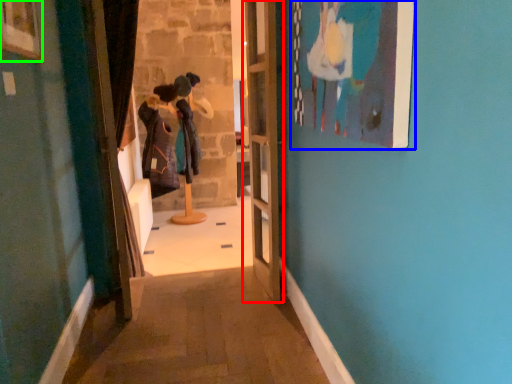
Question: Considering the real-world distances, which object is closest to door (highlighted by a red box)? picture frame (highlighted by a blue box) or picture frame (highlighted by a green box).

Choices:
 (A) picture frame
 (B) picture frame

Answer: (A)